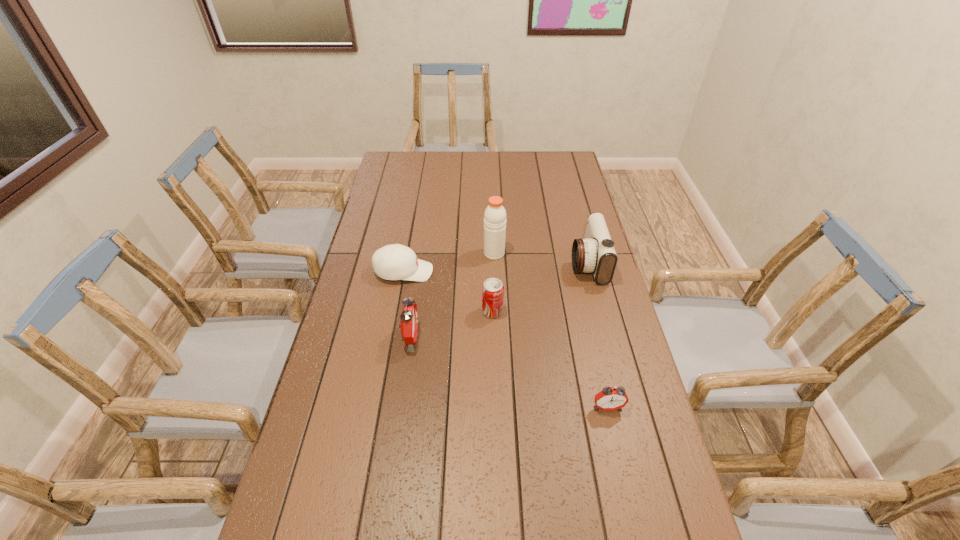
At what (x,y) coordinates should I click in order to perform the action: click on vacant position located 0.350m on the front-facing side of the baseball cap. Please return your answer as a coordinate pair (x, y). The width and height of the screenshot is (960, 540). Looking at the image, I should click on (533, 272).

At what (x,y) coordinates should I click in order to perform the action: click on blank area located 0.090m on the surface of the camcorder. Please return your answer as a coordinate pair (x, y). The image size is (960, 540). Looking at the image, I should click on (545, 263).

Find the location of a particular element. Image resolution: width=960 pixels, height=540 pixels. vacant space located on the surface of the camcorder is located at coordinates (523, 263).

I want to click on free location located 0.200m on the surface of the camcorder, so click(515, 263).

What are the coordinates of `free space located on the back of the shaker` in the screenshot? It's located at (493, 222).

Identify the location of vacant space located on the right of the soda can. Image resolution: width=960 pixels, height=540 pixels. (618, 311).

You are a GUI agent. You are given a task and a screenshot of the screen. Output one action in this format:
    pyautogui.click(x=<x>, y=<y>)
    Task: Click on the object located at the left edge
    
    Given the screenshot: What is the action you would take?
    pyautogui.click(x=392, y=262)

Where is `alarm clock that is at the right edge`? This screenshot has height=540, width=960. alarm clock that is at the right edge is located at coordinates (610, 398).

Identify the location of camcorder positioned at the right edge. (596, 254).

This screenshot has width=960, height=540. In the image, there is a desktop. Find the location of `vacant region at the far edge`. vacant region at the far edge is located at coordinates (477, 177).